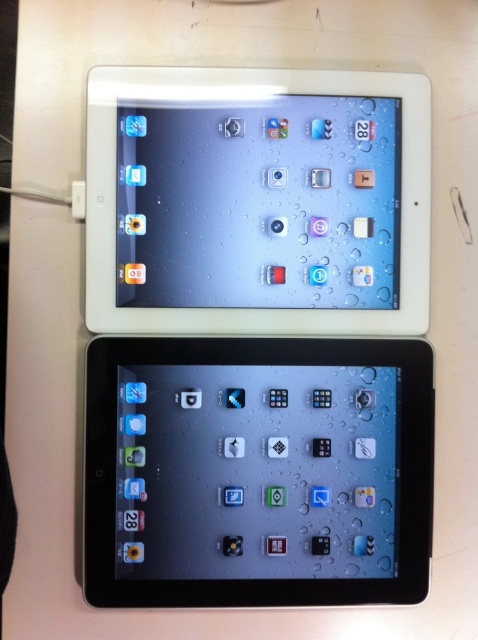
Question: Does black plastic tablet at center appear under white glossy tablet at upper center?

Choices:
 (A) yes
 (B) no

Answer: (A)

Question: Does black plastic tablet at center have a larger size compared to white glossy tablet at upper center?

Choices:
 (A) yes
 (B) no

Answer: (A)

Question: Does black plastic tablet at center have a larger size compared to white glossy tablet at upper center?

Choices:
 (A) no
 (B) yes

Answer: (B)

Question: Which object is farther from the camera taking this photo?

Choices:
 (A) black plastic tablet at center
 (B) white glossy tablet at upper center

Answer: (B)

Question: Which point is farther to the camera?

Choices:
 (A) tap(117, 364)
 (B) tap(96, 125)

Answer: (A)